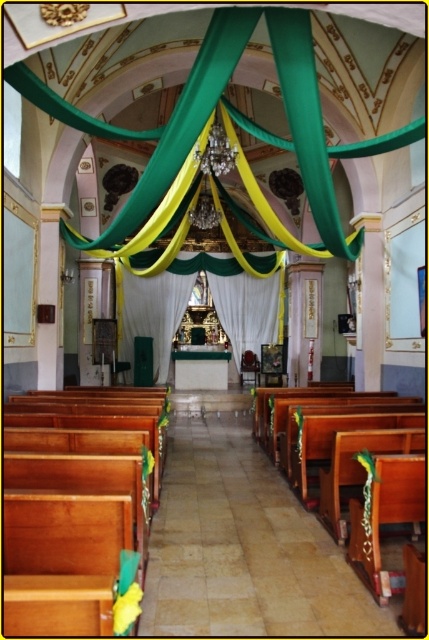
Question: Does wooden pews at center appear over white fabric curtain at center?

Choices:
 (A) no
 (B) yes

Answer: (A)

Question: Can you confirm if wooden pews at center is smaller than white sheer curtain at center?

Choices:
 (A) yes
 (B) no

Answer: (A)

Question: In this image, where is wooden pews at center located relative to white fabric curtain at center?

Choices:
 (A) below
 (B) above

Answer: (A)

Question: Estimate the real-world distances between objects in this image. Which object is farther from the wooden pews at center?

Choices:
 (A) white fabric curtain at center
 (B) white sheer curtain at center

Answer: (A)

Question: Which object appears closest to the camera in this image?

Choices:
 (A) white sheer curtain at center
 (B) wooden pews at center

Answer: (B)

Question: Which object is closer to the camera taking this photo?

Choices:
 (A) wooden pews at center
 (B) white sheer curtain at center

Answer: (A)